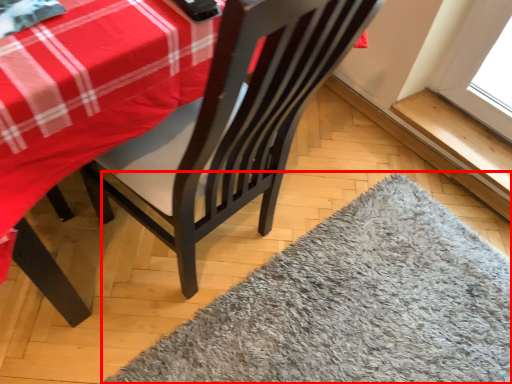
Question: From the image's perspective, where is mat (annotated by the red box) located relative to window sill?

Choices:
 (A) below
 (B) above

Answer: (A)